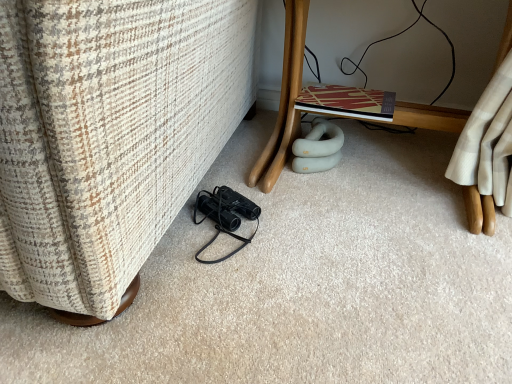
This screenshot has width=512, height=384. What do you see at coordinates (285, 99) in the screenshot?
I see `wooden table at lower center` at bounding box center [285, 99].

You are a GUI agent. You are given a task and a screenshot of the screen. Output one action in this format:
    pyautogui.click(x=<x>, y=<y>)
    Task: Click on the wooden table at lower center
    
    Given the screenshot: What is the action you would take?
    pyautogui.click(x=285, y=99)

Locate an element on the screen. The image size is (512, 384). wooden table at lower center is located at coordinates (285, 99).